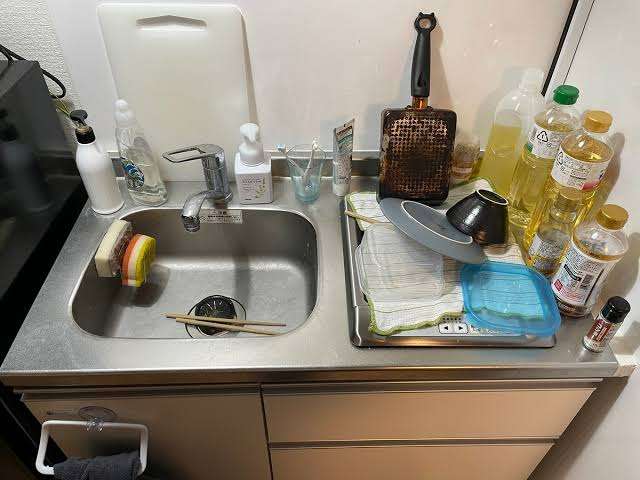
The height and width of the screenshot is (480, 640). Find the location of `handle of pan`. handle of pan is located at coordinates (422, 62).